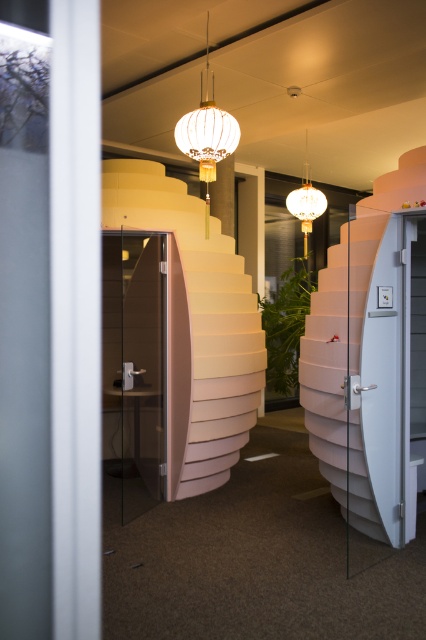
In the scene shown: Does transparent glass door at left appear on the left side of matte white globe at upper center?

Yes, transparent glass door at left is to the left of matte white globe at upper center.

At what (x,y) coordinates should I click in order to perform the action: click on transparent glass door at left. Please return your answer as a coordinate pair (x, y). Looking at the image, I should click on (134, 372).

What do you see at coordinates (195, 324) in the screenshot? This screenshot has width=426, height=640. I see `matte pink stairs at center` at bounding box center [195, 324].

At what (x,y) coordinates should I click in order to perform the action: click on matte pink stairs at center. Please return your answer as a coordinate pair (x, y). Looking at the image, I should click on (195, 324).

Measure the distance between matte pink stairs at center and camera.

A distance of 13.65 feet exists between matte pink stairs at center and camera.

The height and width of the screenshot is (640, 426). I want to click on matte pink stairs at center, so click(x=195, y=324).

Based on the photo, can you confirm if matte pink stairs at center is smaller than transparent glass door at left?

Yes.

Can you confirm if matte pink stairs at center is wider than transparent glass door at left?

Correct, the width of matte pink stairs at center exceeds that of transparent glass door at left.

Identify the location of matte pink stairs at center. (195, 324).